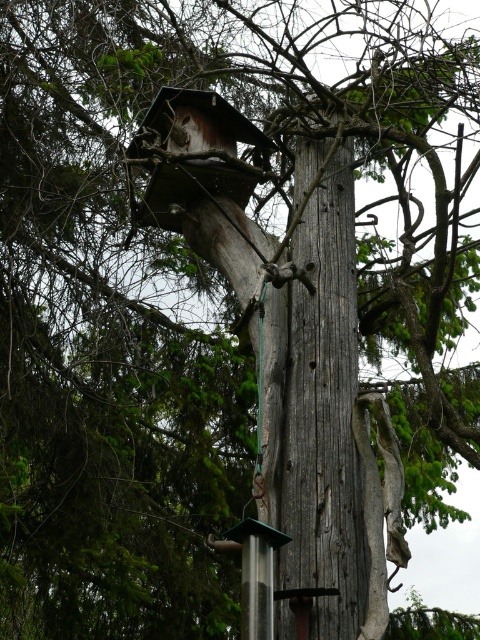
Who is positioned more to the left, weathered wood tree trunk at center or wooden birdhouse at upper center?

wooden birdhouse at upper center is more to the left.

Is weathered wood tree trunk at center behind wooden birdhouse at upper center?

No, it is not.

Which is behind, point (320, 195) or point (207, 109)?

The point (207, 109) is behind.

This screenshot has height=640, width=480. In order to click on weathered wood tree trunk at center in this screenshot , I will do `click(328, 410)`.